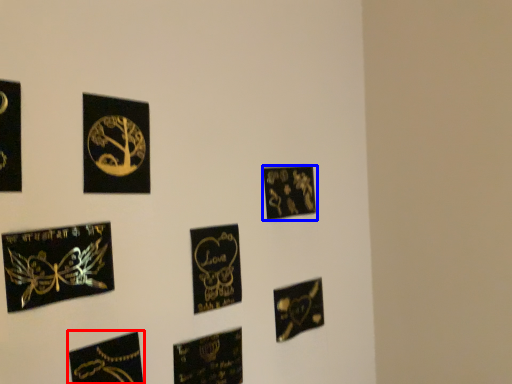
Question: Which of the following is the closest to the observer, picture frame (highlighted by a red box) or picture frame (highlighted by a blue box)?

Choices:
 (A) picture frame
 (B) picture frame

Answer: (A)